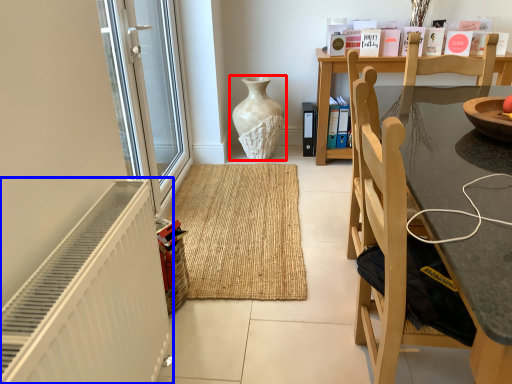
Question: Which of the following is the farthest to the observer, vase (highlighted by a red box) or radiator (highlighted by a blue box)?

Choices:
 (A) vase
 (B) radiator

Answer: (A)